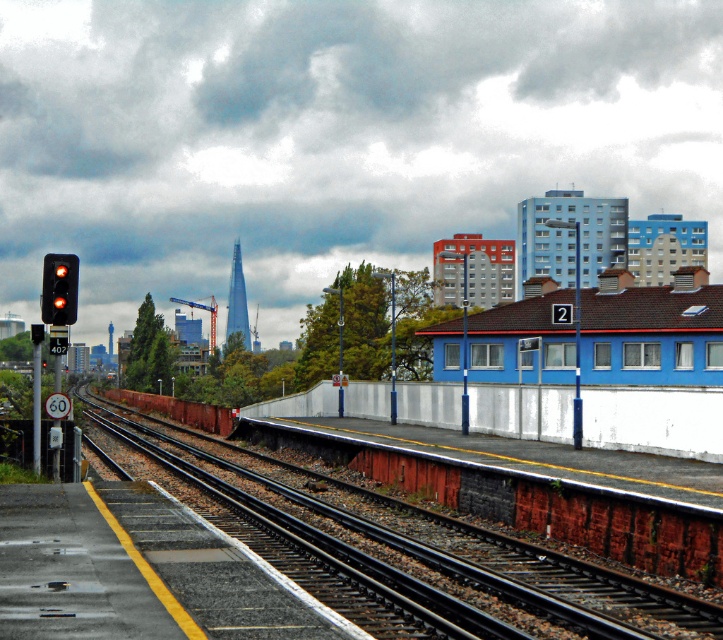
Is smooth concrete track at center below blue matte building at center-right?

Correct, smooth concrete track at center is located below blue matte building at center-right.

Between point (248, 502) and point (641, 289), which one is positioned behind?

Positioned behind is point (641, 289).

Where is `smooth concrete track at center`? smooth concrete track at center is located at coordinates (424, 552).

Locate an element on the screen. The height and width of the screenshot is (640, 723). smooth concrete track at center is located at coordinates (424, 552).

From the picture: Between blue matte building at center-right and red glass traffic light at left, which one appears on the right side from the viewer's perspective?

blue matte building at center-right is more to the right.

Can you confirm if blue matte building at center-right is positioned above red glass traffic light at left?

No.

Is point (719, 291) behind point (48, 289)?

Yes, point (719, 291) is farther from viewer.

I want to click on blue matte building at center-right, so click(651, 333).

Who is more distant from viewer, (596,616) or (67,264)?

Point (67,264)

What do you see at coordinates (424, 552) in the screenshot? I see `smooth concrete track at center` at bounding box center [424, 552].

Is point (578, 573) positioned behind point (56, 289)?

No, it is not.

This screenshot has width=723, height=640. I want to click on smooth concrete track at center, so click(424, 552).